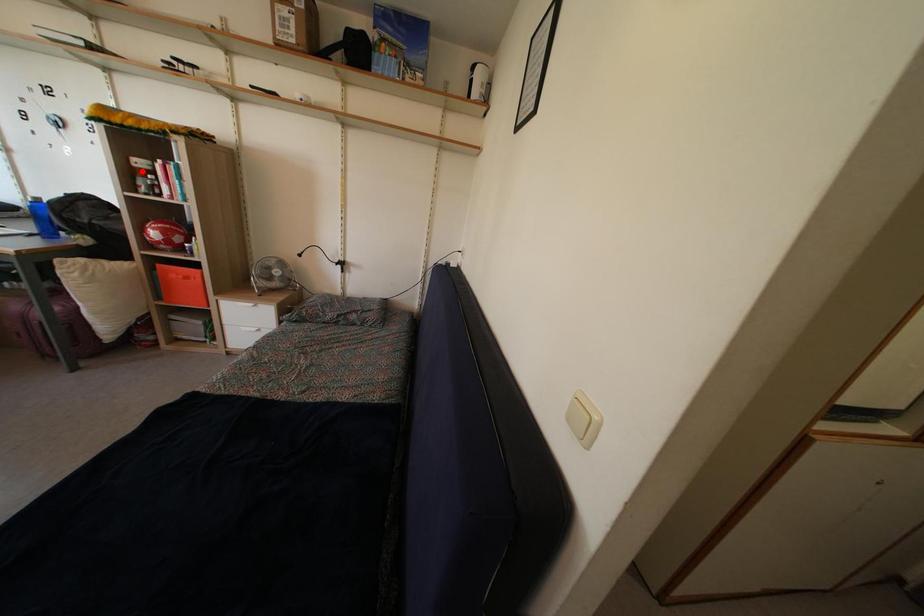
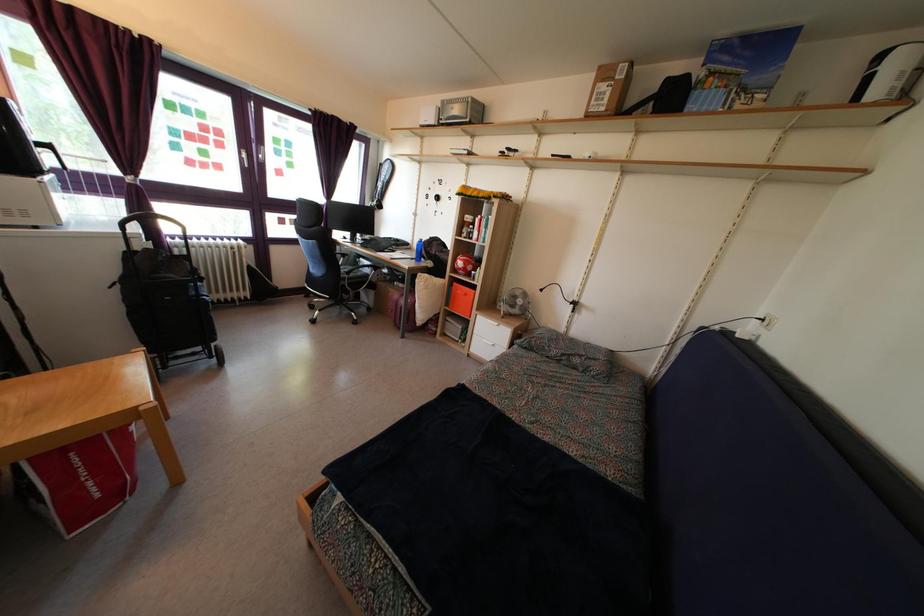
Find the pixel in the second image that matches the highlighted location in the first image.

(470, 227)